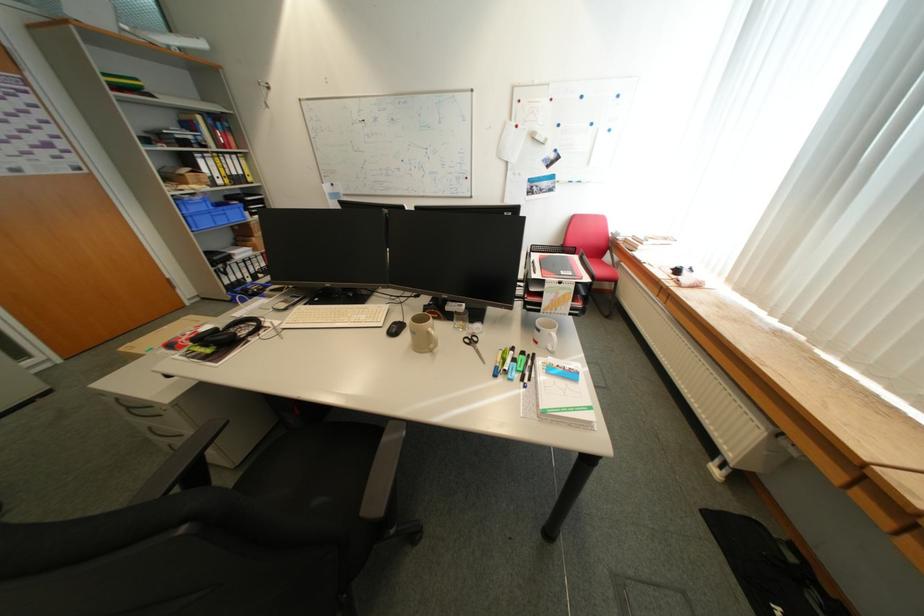
Locate an element on the screen. This screenshot has width=924, height=616. beige coffee mug is located at coordinates (421, 333).